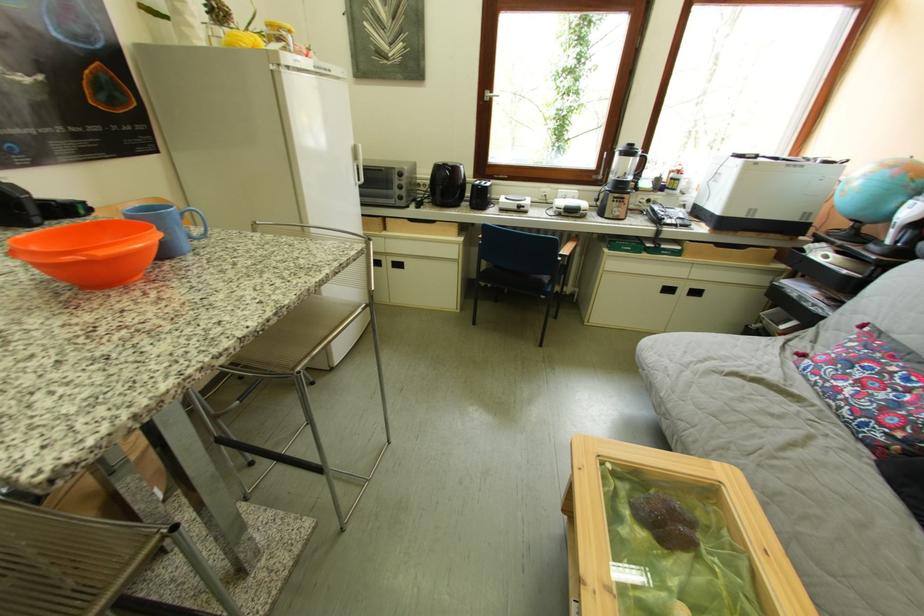
Describe the element at coordinates (301, 331) in the screenshot. I see `the metal chair sitting surface` at that location.